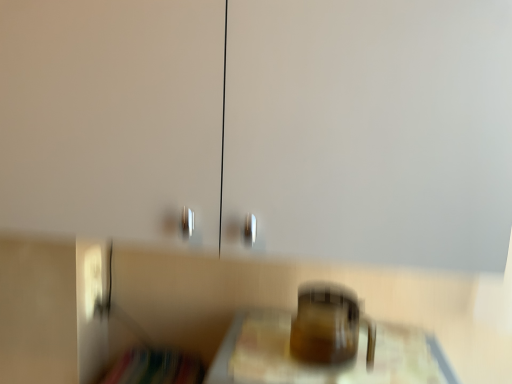
Question: Is translucent glass jar at center at the back of translucent glass mug at center?

Choices:
 (A) no
 (B) yes

Answer: (A)

Question: Considering the relative sizes of translucent glass mug at center and translucent glass jar at center in the image provided, is translucent glass mug at center shorter than translucent glass jar at center?

Choices:
 (A) yes
 (B) no

Answer: (A)

Question: Is there a large distance between translucent glass mug at center and translucent glass jar at center?

Choices:
 (A) no
 (B) yes

Answer: (A)

Question: Is translucent glass mug at center surrounding translucent glass jar at center?

Choices:
 (A) no
 (B) yes

Answer: (A)

Question: Does translucent glass mug at center have a larger size compared to translucent glass jar at center?

Choices:
 (A) yes
 (B) no

Answer: (B)

Question: From a real-world perspective, does translucent glass mug at center stand above translucent glass jar at center?

Choices:
 (A) no
 (B) yes

Answer: (B)

Question: Does translucent glass jar at center have a lesser height compared to translucent glass mug at center?

Choices:
 (A) yes
 (B) no

Answer: (B)

Question: Is translucent glass jar at center positioned with its back to translucent glass mug at center?

Choices:
 (A) no
 (B) yes

Answer: (A)

Question: Is translucent glass jar at center behind translucent glass mug at center?

Choices:
 (A) yes
 (B) no

Answer: (B)

Question: From a real-world perspective, is translucent glass jar at center physically below translucent glass mug at center?

Choices:
 (A) yes
 (B) no

Answer: (A)

Question: Is translucent glass jar at center outside of translucent glass mug at center?

Choices:
 (A) yes
 (B) no

Answer: (A)

Question: Could you tell me if translucent glass jar at center is facing translucent glass mug at center?

Choices:
 (A) no
 (B) yes

Answer: (A)

Question: From the image's perspective, is translucent glass jar at center above or below translucent glass mug at center?

Choices:
 (A) below
 (B) above

Answer: (A)